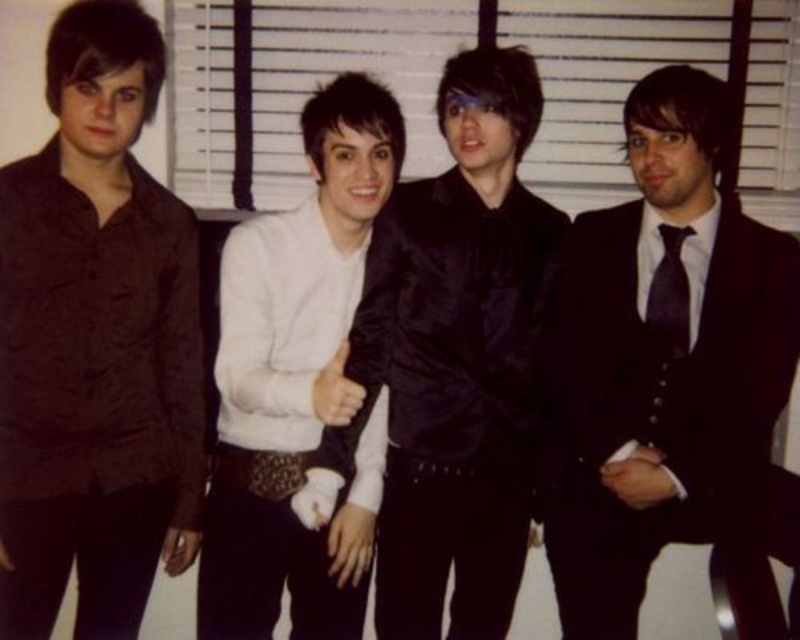
Is shiny black suit at right shorter than black satin tie at right?

In fact, shiny black suit at right may be taller than black satin tie at right.

Is point (734, 436) closer to viewer compared to point (670, 355)?

Yes, it is.

Locate an element on the screen. shiny black suit at right is located at coordinates (660, 365).

Based on the photo, who is positioned more to the left, satin black suit at center or white matte shirt at center?

From the viewer's perspective, white matte shirt at center appears more on the left side.

Is satin black suit at center taller than white matte shirt at center?

No, satin black suit at center is not taller than white matte shirt at center.

At what (x,y) coordinates should I click in order to perform the action: click on satin black suit at center. Please return your answer as a coordinate pair (x, y). Looking at the image, I should click on (450, 397).

Which is above, shiny black suit at right or satin black suit at center?

shiny black suit at right

The width and height of the screenshot is (800, 640). What do you see at coordinates (660, 365) in the screenshot?
I see `shiny black suit at right` at bounding box center [660, 365].

Identify the location of shiny black suit at right. This screenshot has width=800, height=640. pos(660,365).